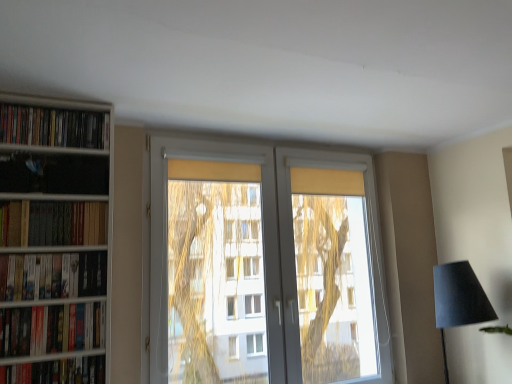
Question: Does matte black lampshade at lower right appear on the right side of hardcover book at lower left, the first book in the bottom-to-top sequence?

Choices:
 (A) no
 (B) yes

Answer: (B)

Question: Is hardcover book at lower left, the first book in the bottom-to-top sequence, located within matte black lampshade at lower right?

Choices:
 (A) yes
 (B) no

Answer: (B)

Question: Does matte black lampshade at lower right have a greater width compared to hardcover book at lower left, the first book in the bottom-to-top sequence?

Choices:
 (A) yes
 (B) no

Answer: (A)

Question: Does matte black lampshade at lower right come in front of hardcover book at lower left, which appears as the 5th book when viewed from the top?

Choices:
 (A) yes
 (B) no

Answer: (B)

Question: From a real-world perspective, is matte black lampshade at lower right over hardcover book at lower left, which appears as the 5th book when viewed from the top?

Choices:
 (A) yes
 (B) no

Answer: (A)

Question: Is point (0, 286) positioned closer to the camera than point (10, 139)?

Choices:
 (A) closer
 (B) farther

Answer: (A)

Question: In the image, is matte black bookshelf at left, which appears as the third book when viewed from the top, positioned in front of or behind matte black books at left, arranged as the 1th book when viewed from the top?

Choices:
 (A) behind
 (B) front

Answer: (B)

Question: Is matte black bookshelf at left, positioned as the third book in bottom-to-top order, spatially inside matte black books at left, arranged as the 1th book when viewed from the top, or outside of it?

Choices:
 (A) inside
 (B) outside

Answer: (B)

Question: Looking at the image, does matte black bookshelf at left, positioned as the third book in bottom-to-top order, seem bigger or smaller compared to matte black books at left, the fifth book positioned from the bottom?

Choices:
 (A) small
 (B) big

Answer: (A)

Question: Based on their sizes in the image, would you say matte black bookshelf at left, positioned as the third book in bottom-to-top order, is bigger or smaller than hardcover books at left, which is counted as the 2th book, starting from the top?

Choices:
 (A) small
 (B) big

Answer: (A)

Question: From the image's perspective, is matte black bookshelf at left, which appears as the third book when viewed from the top, above or below hardcover books at left, which appears as the fourth book when ordered from the bottom?

Choices:
 (A) above
 (B) below

Answer: (B)

Question: In terms of height, does matte black bookshelf at left, which appears as the third book when viewed from the top, look taller or shorter compared to hardcover books at left, which is counted as the 2th book, starting from the top?

Choices:
 (A) tall
 (B) short

Answer: (A)

Question: Does point (22, 288) appear closer or farther from the camera than point (74, 233)?

Choices:
 (A) closer
 (B) farther

Answer: (A)

Question: From a real-world perspective, relative to hardcover book at lower left, the first book in the bottom-to-top sequence, is hardcover books at left, which appears as the fourth book when ordered from the bottom, vertically above or below?

Choices:
 (A) above
 (B) below

Answer: (A)

Question: Looking at their shapes, would you say hardcover books at left, which is counted as the 2th book, starting from the top, is wider or thinner than hardcover book at lower left, the first book in the bottom-to-top sequence?

Choices:
 (A) wide
 (B) thin

Answer: (A)